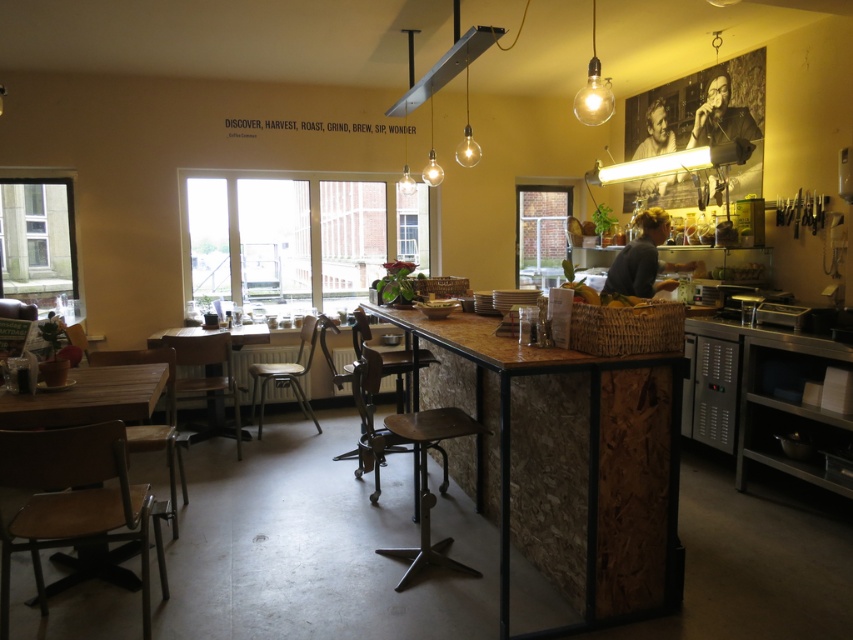
You are a customer entering the cozy cafe and want to sit down. You see the wooden seat at center and the translucent glass bulb at upper center. Which object is taller?

The wooden seat at center is taller than the translucent glass bulb at upper center.

From the picture: You are sitting in the wooden seat at center of the cozy cafe and want to look at the translucent glass bulb at upper center. In which direction should you turn your head?

You should turn your head to the right to look at the translucent glass bulb at upper center because the wooden seat at center is to the left of it.